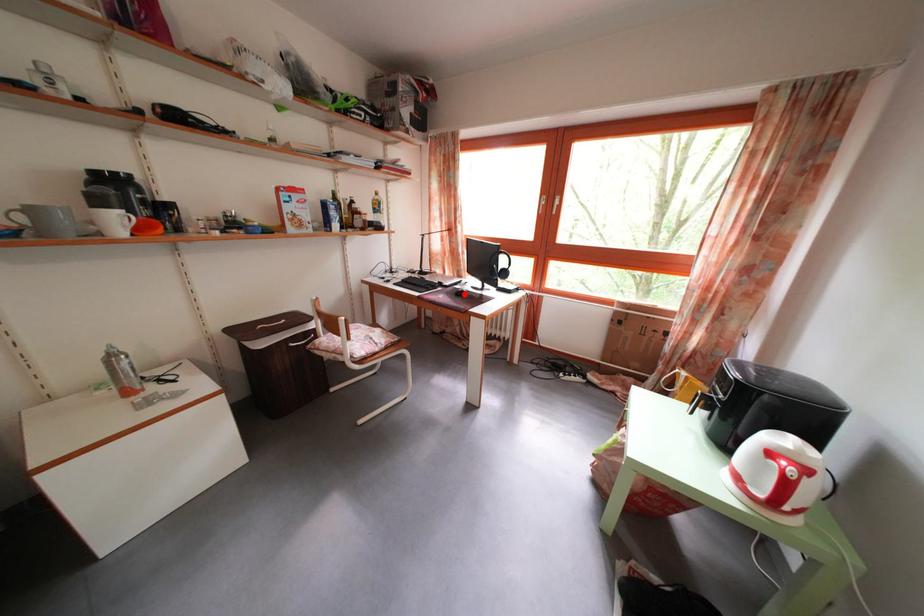
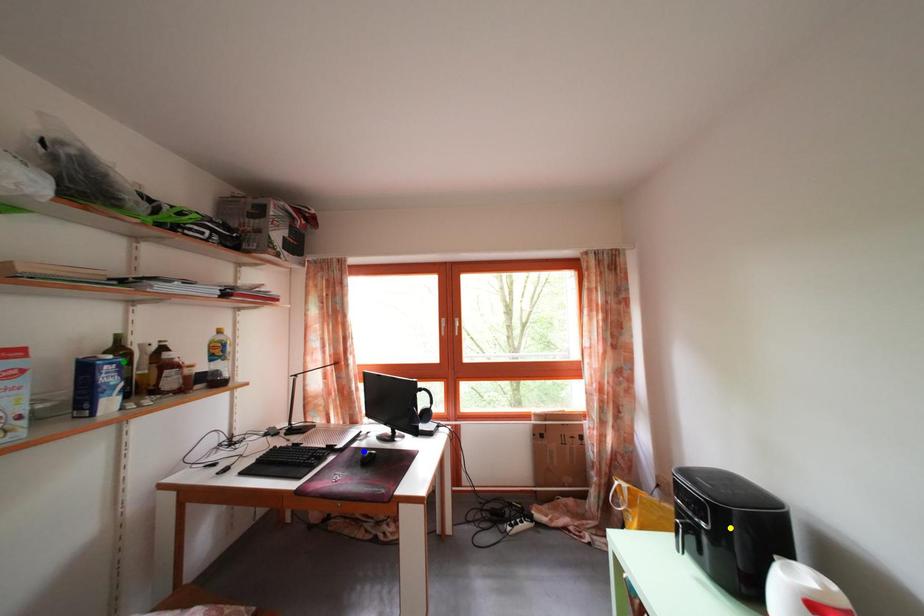
Question: I am providing you with two images of the same scene from different viewpoints. A red point is marked on the first image. You are given multiple points on the second image. Which spot in image 2 lines up with the point in image 1?

Choices:
 (A) blue point
 (B) green point
 (C) yellow point

Answer: (A)